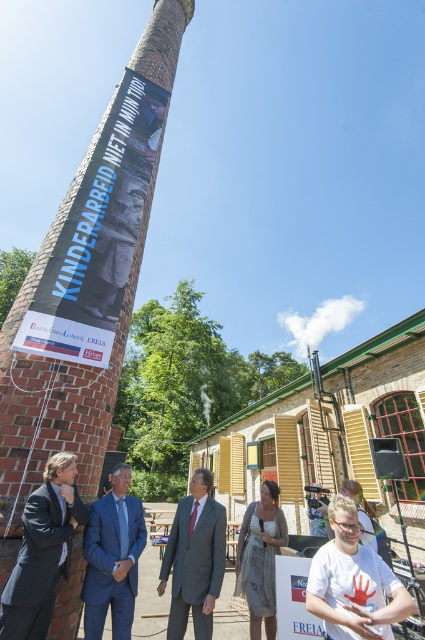
Is white cotton t-shirt at lower right wider than blue suit at center?

Yes.

Is white cotton t-shirt at lower right to the right of blue suit at center from the viewer's perspective?

Indeed, white cotton t-shirt at lower right is positioned on the right side of blue suit at center.

Locate an element on the screen. This screenshot has height=640, width=425. white cotton t-shirt at lower right is located at coordinates (354, 582).

Does blue suit at center come in front of matte gray suit at center?

Yes, it is.

Who is lower down, blue suit at center or matte gray suit at center?

Positioned lower is matte gray suit at center.

Between point (119, 557) and point (189, 488), which one is positioned in front?

Point (119, 557)

Image resolution: width=425 pixels, height=640 pixels. Find the location of `blue suit at center`. blue suit at center is located at coordinates (113, 557).

Between white cotton t-shirt at lower right and dark gray wool suit at lower left, which one appears on the right side from the viewer's perspective?

white cotton t-shirt at lower right is more to the right.

Is white cotton t-shirt at lower right to the right of dark gray wool suit at lower left from the viewer's perspective?

Indeed, white cotton t-shirt at lower right is positioned on the right side of dark gray wool suit at lower left.

You are a GUI agent. You are given a task and a screenshot of the screen. Output one action in this format:
    pyautogui.click(x=<x>, y=<y>)
    Task: Click on the white cotton t-shirt at lower right
    
    Given the screenshot: What is the action you would take?
    pyautogui.click(x=354, y=582)